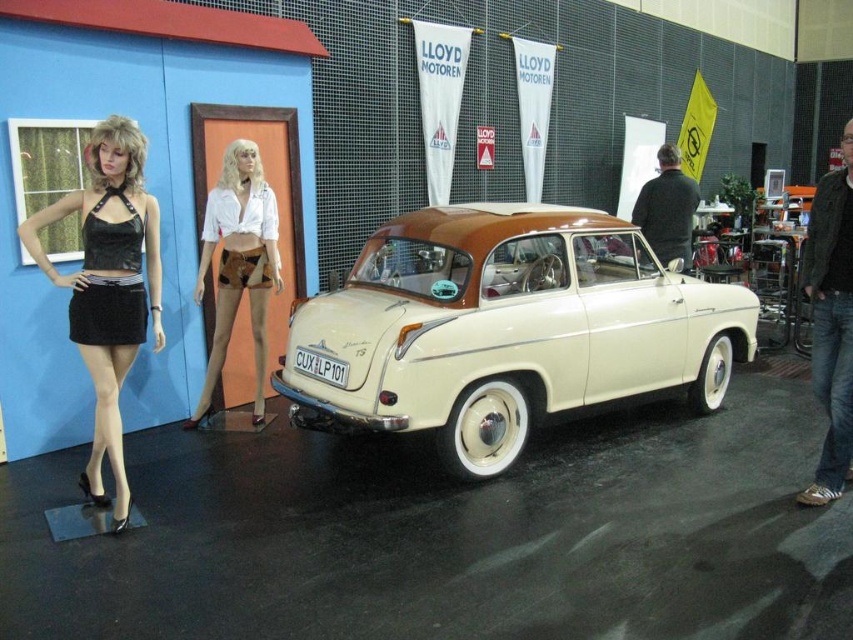
You are a photographer setting up for a photoshoot at a car exhibition. You need to position a tripod to capture both the vintage car and the black velvet dress at left. Where should you place the tripod to ensure both are in frame?

Place the tripod near the center of the room, facing the vintage car and the black velvet dress at left. Since the black velvet dress at left is located at point (x=108, y=285), positioning the tripod centrally will allow both subjects to be captured in the frame.

You are a fashion designer observing the vintage car exhibition. You notice the black velvet dress at left and the brown suede shorts at center. Which clothing item is taller?

The black velvet dress at left is taller than the brown suede shorts at center.

You are standing in front of the vintage car at the exhibition and want to take a photo that includes both the car and the two mannequins. The mannequins are positioned at the coordinates point (585, 355) and point (299, 362). Which mannequin is closer to you so that I can focus on it first?

Point (585, 355) is further to the camera than point (299, 362). Wait, the question asks which is closer to you. Since point (585, 355) is further to the camera, that means it is farther away from you. Therefore, point (299, 362) is closer to you and should be focused on first.